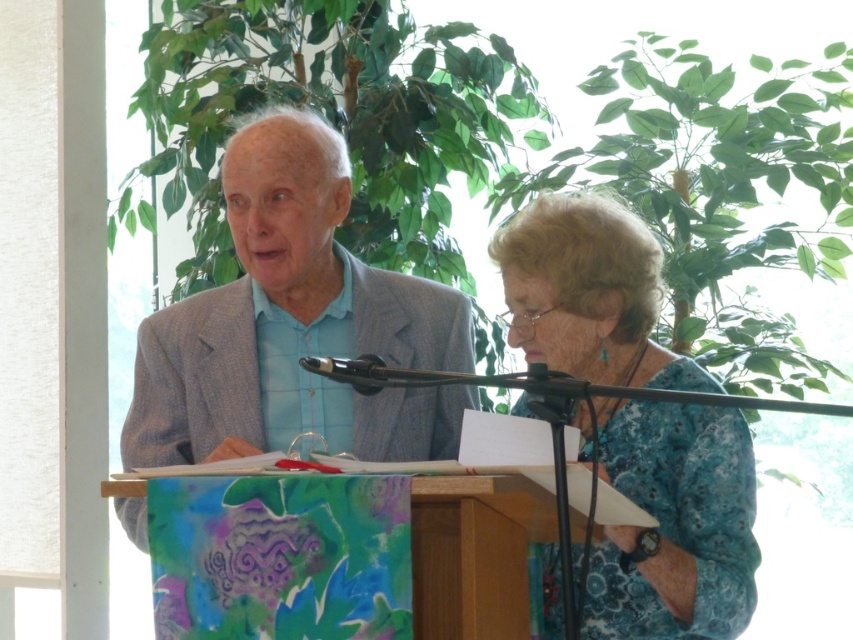
Question: Estimate the real-world distances between objects in this image. Which object is farther from the black metallic microphone at center?

Choices:
 (A) light blue shirt at center
 (B) blue floral blouse at center
 (C) light gray suit at center

Answer: (C)

Question: Does light blue shirt at center appear on the right side of blue floral blouse at center?

Choices:
 (A) yes
 (B) no

Answer: (B)

Question: Which point is closer to the camera?

Choices:
 (A) (656, 417)
 (B) (340, 380)
 (C) (589, 444)

Answer: (B)

Question: Does light gray suit at center appear on the right side of blue floral blouse at center?

Choices:
 (A) yes
 (B) no

Answer: (B)

Question: Can you confirm if blue floral blouse at center is positioned to the left of black metallic microphone at center?

Choices:
 (A) no
 (B) yes

Answer: (A)

Question: Estimate the real-world distances between objects in this image. Which object is closer to the light gray suit at center?

Choices:
 (A) light blue shirt at center
 (B) blue floral blouse at center

Answer: (A)